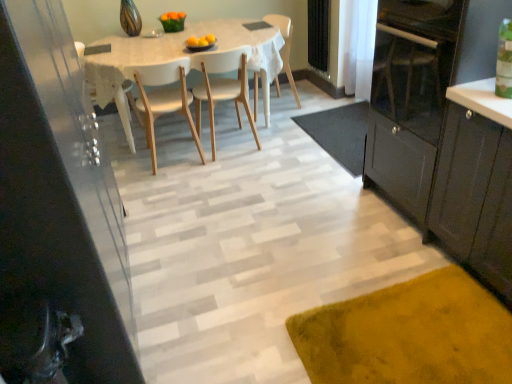
Question: Is matte black cabinet at left, which is the first cabinetry in left-to-right order, behind white sheer curtain at upper right?

Choices:
 (A) yes
 (B) no

Answer: (B)

Question: Can you confirm if matte black cabinet at left, marked as the second cabinetry in a right-to-left arrangement, is thinner than white sheer curtain at upper right?

Choices:
 (A) yes
 (B) no

Answer: (B)

Question: Is matte black cabinet at left, marked as the second cabinetry in a right-to-left arrangement, facing towards white sheer curtain at upper right?

Choices:
 (A) no
 (B) yes

Answer: (A)

Question: Considering the relative sizes of matte black cabinet at left, which is the first cabinetry in left-to-right order, and white sheer curtain at upper right in the image provided, is matte black cabinet at left, which is the first cabinetry in left-to-right order, shorter than white sheer curtain at upper right?

Choices:
 (A) yes
 (B) no

Answer: (B)

Question: Is matte black cabinet at left, marked as the second cabinetry in a right-to-left arrangement, turned away from white sheer curtain at upper right?

Choices:
 (A) yes
 (B) no

Answer: (B)

Question: From a real-world perspective, is matte black cabinet at left, marked as the second cabinetry in a right-to-left arrangement, positioned over white sheer curtain at upper right based on gravity?

Choices:
 (A) no
 (B) yes

Answer: (B)

Question: Is matte black cabinet at left, marked as the second cabinetry in a right-to-left arrangement, facing towards white wood table at center?

Choices:
 (A) yes
 (B) no

Answer: (B)

Question: Is matte black cabinet at left, marked as the second cabinetry in a right-to-left arrangement, looking in the opposite direction of white wood table at center?

Choices:
 (A) no
 (B) yes

Answer: (A)

Question: Considering the relative sizes of matte black cabinet at left, marked as the second cabinetry in a right-to-left arrangement, and white wood table at center in the image provided, is matte black cabinet at left, marked as the second cabinetry in a right-to-left arrangement, shorter than white wood table at center?

Choices:
 (A) yes
 (B) no

Answer: (B)

Question: From a real-world perspective, is matte black cabinet at left, marked as the second cabinetry in a right-to-left arrangement, located higher than white wood table at center?

Choices:
 (A) no
 (B) yes

Answer: (B)

Question: From a real-world perspective, is matte black cabinet at left, marked as the second cabinetry in a right-to-left arrangement, positioned under white wood table at center based on gravity?

Choices:
 (A) yes
 (B) no

Answer: (B)

Question: Does matte black cabinet at left, which is the first cabinetry in left-to-right order, appear on the left side of white wood table at center?

Choices:
 (A) yes
 (B) no

Answer: (A)

Question: Can you confirm if matte black cabinet at left, marked as the second cabinetry in a right-to-left arrangement, is taller than white wood chair at center, positioned as the first chair in right-to-left order?

Choices:
 (A) no
 (B) yes

Answer: (B)